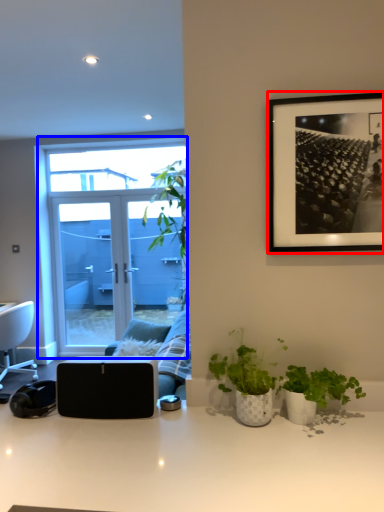
Question: Which object appears closest to the camera in this image, picture frame (highlighted by a red box) or window (highlighted by a blue box)?

Choices:
 (A) picture frame
 (B) window

Answer: (A)